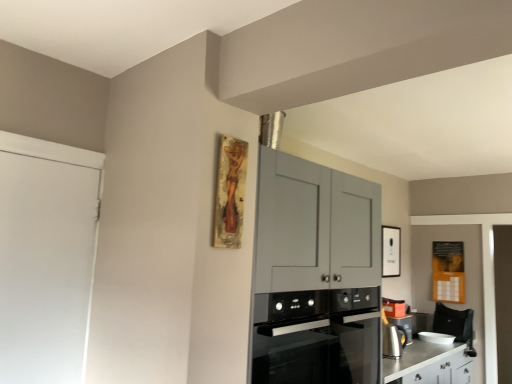
Question: Considering the relative sizes of white glossy picture frame at upper right and satin silver kettle at lower right, marked as the first appliance in a left-to-right arrangement, in the image provided, is white glossy picture frame at upper right thinner than satin silver kettle at lower right, marked as the first appliance in a left-to-right arrangement,?

Choices:
 (A) no
 (B) yes

Answer: (B)

Question: From the image's perspective, is white glossy picture frame at upper right below satin silver kettle at lower right, marked as the first appliance in a left-to-right arrangement?

Choices:
 (A) yes
 (B) no

Answer: (B)

Question: From the image's perspective, is white glossy picture frame at upper right on top of satin silver kettle at lower right, which is the second appliance from bottom to top?

Choices:
 (A) no
 (B) yes

Answer: (B)

Question: Considering the relative sizes of white glossy picture frame at upper right and satin silver kettle at lower right, marked as the second appliance in a back-to-front arrangement, in the image provided, is white glossy picture frame at upper right wider than satin silver kettle at lower right, marked as the second appliance in a back-to-front arrangement,?

Choices:
 (A) yes
 (B) no

Answer: (B)

Question: Is white glossy picture frame at upper right aimed at satin silver kettle at lower right, which is the second appliance from bottom to top?

Choices:
 (A) yes
 (B) no

Answer: (B)

Question: Is white glossy picture frame at upper right positioned beyond the bounds of satin silver kettle at lower right, which is the second appliance from right to left?

Choices:
 (A) yes
 (B) no

Answer: (A)

Question: Considering the relative sizes of satin silver kettle at lower right, which is the second appliance from bottom to top, and black glass oven at center in the image provided, is satin silver kettle at lower right, which is the second appliance from bottom to top, taller than black glass oven at center?

Choices:
 (A) yes
 (B) no

Answer: (B)

Question: Can you confirm if satin silver kettle at lower right, which is the second appliance from right to left, is thinner than black glass oven at center?

Choices:
 (A) yes
 (B) no

Answer: (A)

Question: Is satin silver kettle at lower right, which is the second appliance from bottom to top, turned away from black glass oven at center?

Choices:
 (A) yes
 (B) no

Answer: (B)

Question: From the image's perspective, is satin silver kettle at lower right, which is the second appliance from bottom to top, on top of black glass oven at center?

Choices:
 (A) no
 (B) yes

Answer: (A)

Question: Considering the relative sizes of satin silver kettle at lower right, which is counted as the 1th appliance, starting from the top, and black glass oven at center in the image provided, is satin silver kettle at lower right, which is counted as the 1th appliance, starting from the top, smaller than black glass oven at center?

Choices:
 (A) no
 (B) yes

Answer: (B)

Question: Is black glass oven at center located within satin silver kettle at lower right, which is counted as the 1th appliance, starting from the top?

Choices:
 (A) yes
 (B) no

Answer: (B)

Question: From the image's perspective, would you say white matte door at left is shown under satin silver kettle at lower right, which is the second appliance from right to left?

Choices:
 (A) no
 (B) yes

Answer: (A)